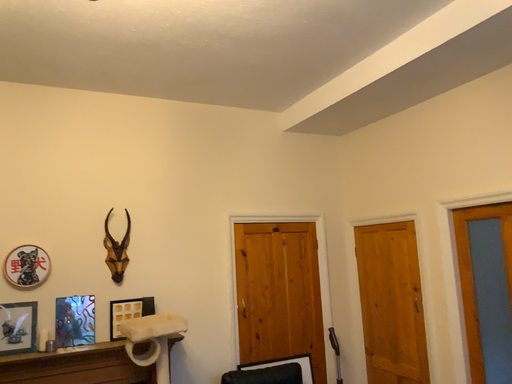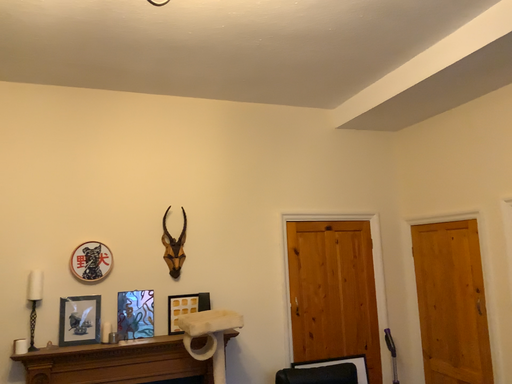
Question: Which way did the camera rotate in the video?

Choices:
 (A) rotated left
 (B) rotated right

Answer: (A)